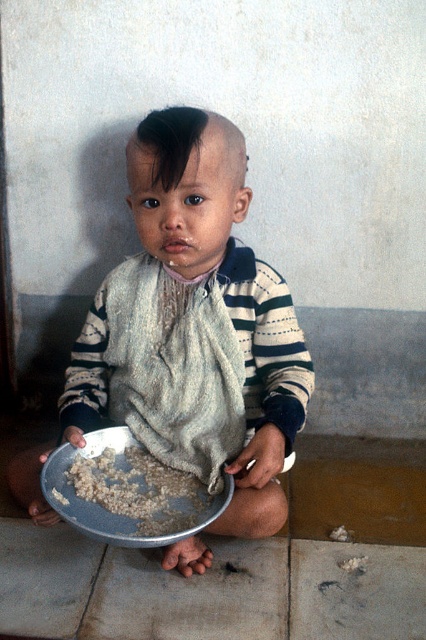
Based on the coordinates provided, which object is located at point (203,298) in the image?

The point (203,298) corresponds to the striped cotton shirt at center.

The child is wearing a striped cotton shirt at center and has brown rice at lower center in their bowl. Which item is located higher up in the image?

The striped cotton shirt at center is located higher up in the image than the brown rice at lower center.